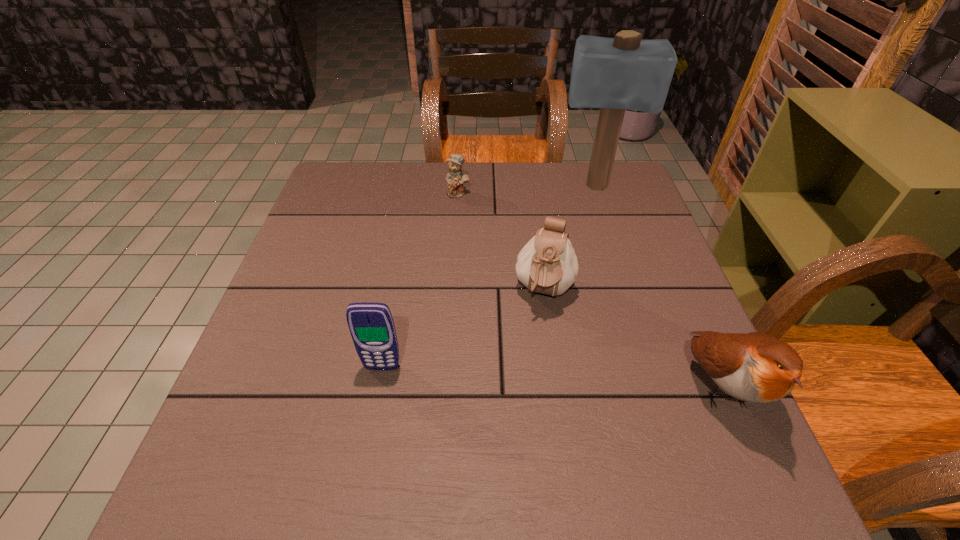
Identify the location of unoccupied position between the bird and the fourth object from right to left. Image resolution: width=960 pixels, height=540 pixels. pos(588,290).

Identify the location of free spot between the third object from left to right and the teddy bear. The width and height of the screenshot is (960, 540). (501, 242).

Locate an element on the screen. This screenshot has width=960, height=540. empty space between the bird and the shortest object is located at coordinates (588, 290).

Where is `free space between the pouch and the bird`? This screenshot has height=540, width=960. free space between the pouch and the bird is located at coordinates (632, 339).

Find the location of a particular element. The height and width of the screenshot is (540, 960). free space between the bird and the third object from right to left is located at coordinates (632, 339).

Where is `empty location between the third farthest object and the bird`? The image size is (960, 540). empty location between the third farthest object and the bird is located at coordinates (632, 339).

Find the location of a particular element. The image size is (960, 540). unoccupied area between the bird and the teddy bear is located at coordinates (588, 290).

Identify the location of vacant point located between the cellular telephone and the bird. The width and height of the screenshot is (960, 540). (551, 377).

Where is `vacant area between the shortest object and the mallet`? vacant area between the shortest object and the mallet is located at coordinates (527, 191).

Choose which object is the fourth nearest neighbor to the pouch. Please provide its 2D coordinates. Your answer should be formatted as a tuple, i.e. [(x, y)], where the tuple contains the x and y coordinates of a point satisfying the conditions above.

[(456, 177)]